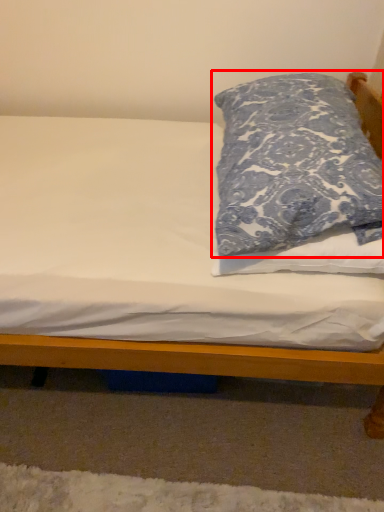
Question: From the image's perspective, what is the correct spatial relationship of pillow (annotated by the red box) in relation to bed?

Choices:
 (A) above
 (B) below

Answer: (A)